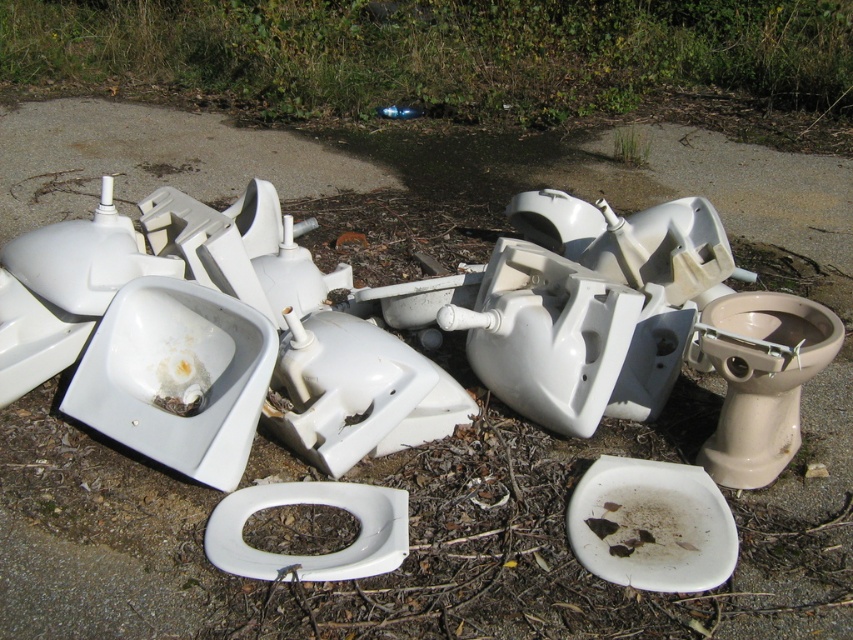
Question: Does white glossy toilet bowl at center-left appear under white glossy toilet bowl at center?

Choices:
 (A) no
 (B) yes

Answer: (A)

Question: Is white matte toilet bowl at center to the right of white glossy toilet bowl at center from the viewer's perspective?

Choices:
 (A) yes
 (B) no

Answer: (A)

Question: Which point is closer to the camera taking this photo?

Choices:
 (A) (195, 288)
 (B) (741, 358)
 (C) (235, 545)
 (D) (646, 548)

Answer: (C)

Question: Can you confirm if beige ceramic toilet bowl at center-right is smaller than white matte toilet bowl at center?

Choices:
 (A) yes
 (B) no

Answer: (B)

Question: Estimate the real-world distances between objects in this image. Which object is farther from the beige ceramic toilet bowl at center-right?

Choices:
 (A) white glossy toilet bowl at center-left
 (B) white glossy toilet bowl at center
 (C) white matte toilet bowl at center

Answer: (A)

Question: Which object is closer to the camera taking this photo?

Choices:
 (A) white glossy toilet bowl at center-left
 (B) beige ceramic toilet bowl at center-right
 (C) white matte toilet bowl at center
 (D) white glossy toilet bowl at center

Answer: (D)